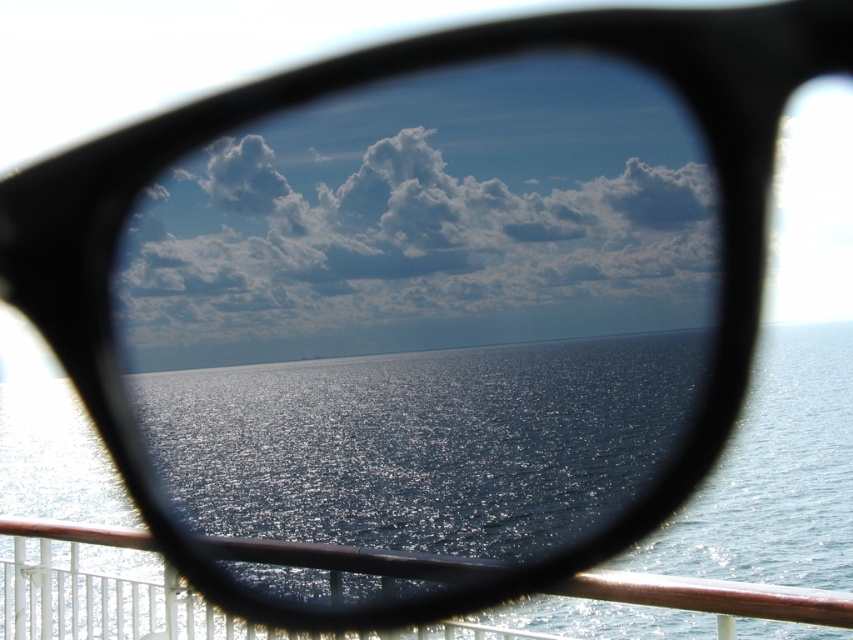
Who is taller, white fluffy cloud at upper center or metallic brown railing at lower center?

white fluffy cloud at upper center

Describe the element at coordinates (410, 244) in the screenshot. I see `white fluffy cloud at upper center` at that location.

This screenshot has height=640, width=853. Identify the location of white fluffy cloud at upper center. (410, 244).

Is white fluffy cloud at upper center further to camera compared to glistening blue water at center?

Yes, it is.

Based on the photo, does white fluffy cloud at upper center appear on the left side of glistening blue water at center?

Correct, you'll find white fluffy cloud at upper center to the left of glistening blue water at center.

Does point (149, 294) come in front of point (805, 541)?

No.

This screenshot has height=640, width=853. Find the location of `white fluffy cloud at upper center`. white fluffy cloud at upper center is located at coordinates (410, 244).

Does point (764, 438) lie behind point (791, 588)?

Yes, point (764, 438) is farther from viewer.

Which is below, glistening blue water at center or metallic brown railing at lower center?

glistening blue water at center is below.

Does point (718, 568) come in front of point (115, 579)?

No, it is behind (115, 579).

At what (x,y) coordinates should I click in order to perform the action: click on glistening blue water at center. Please return your answer as a coordinate pair (x, y). Looking at the image, I should click on (779, 472).